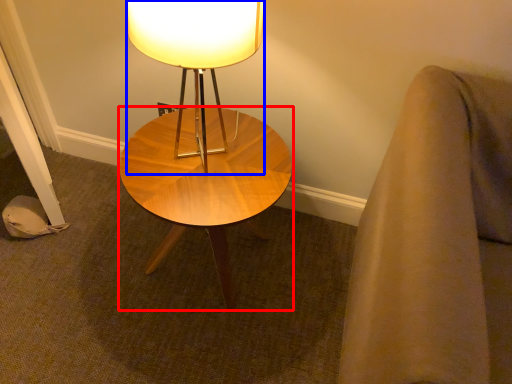
Question: Which object is closer to the camera taking this photo, coffee table (highlighted by a red box) or lamp (highlighted by a blue box)?

Choices:
 (A) coffee table
 (B) lamp

Answer: (B)